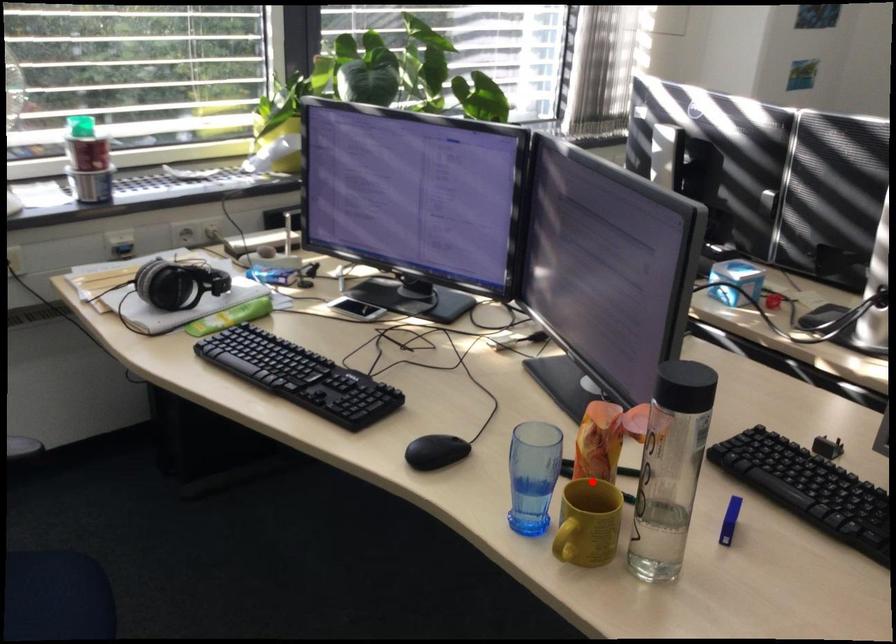
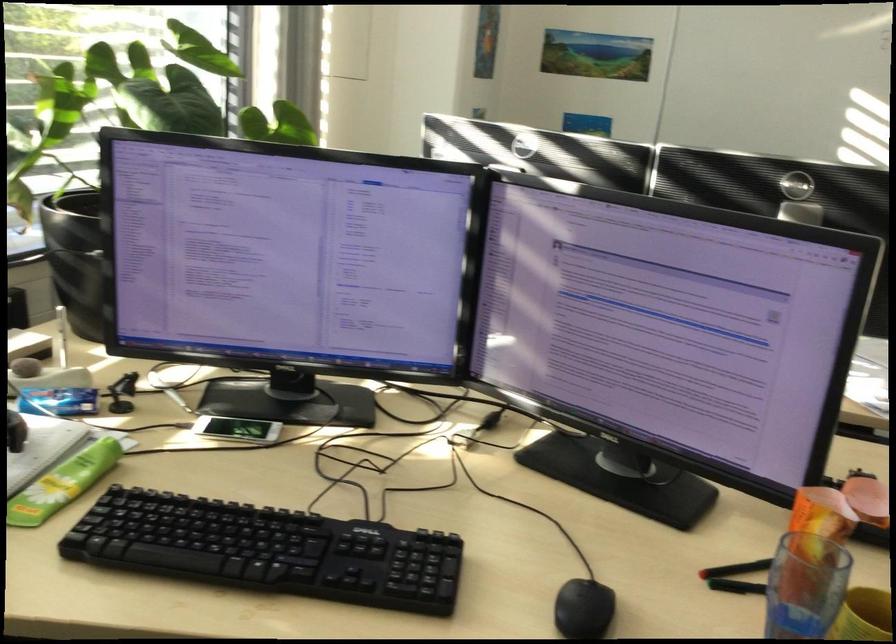
Question: I am providing you with two images of the same scene from different viewpoints. A red point is shown in image1. For the corresponding object point in image2, is it positioned nearer or farther from the camera?

Choices:
 (A) Nearer
 (B) Farther

Answer: (A)